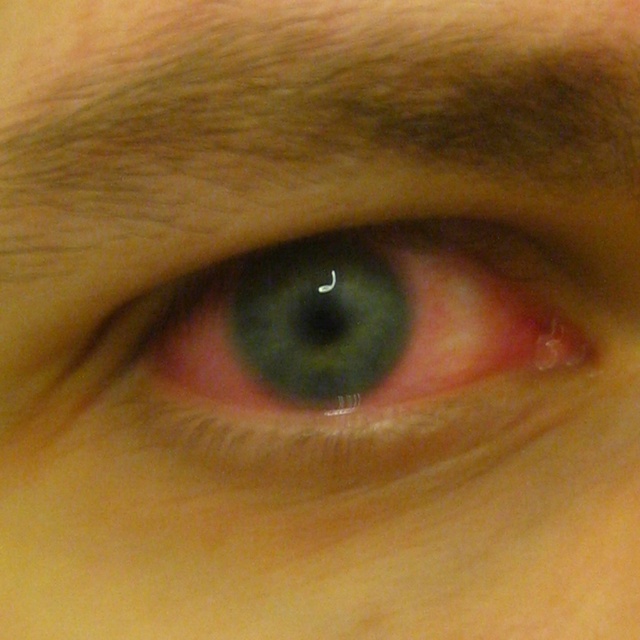
Is brown fuzzy eyebrow at upper center smaller than green matte eye at center?

Actually, brown fuzzy eyebrow at upper center might be larger than green matte eye at center.

Which is in front, point (468, 67) or point (390, 300)?

Point (468, 67) is more forward.

Which is behind, point (620, 168) or point (234, 452)?

The point (234, 452) is more distant.

This screenshot has width=640, height=640. I want to click on brown fuzzy eyebrow at upper center, so click(296, 115).